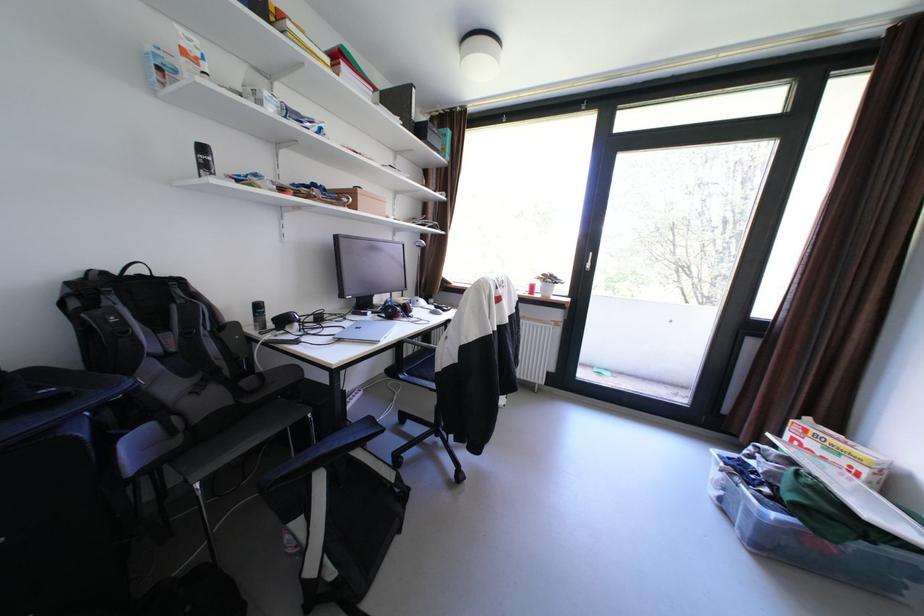
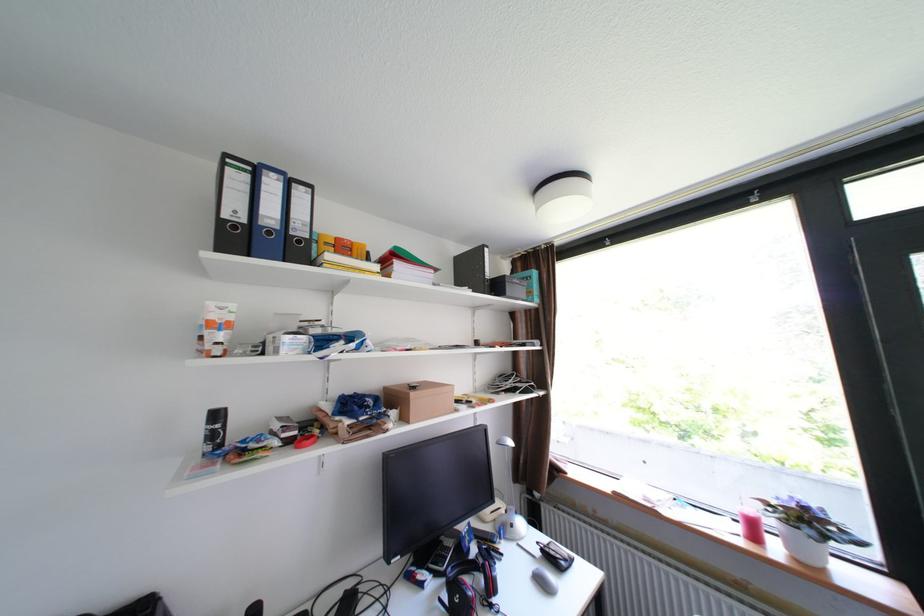
Locate, in the second image, the point that corresponds to pixel 216 167 in the first image.

(225, 436)